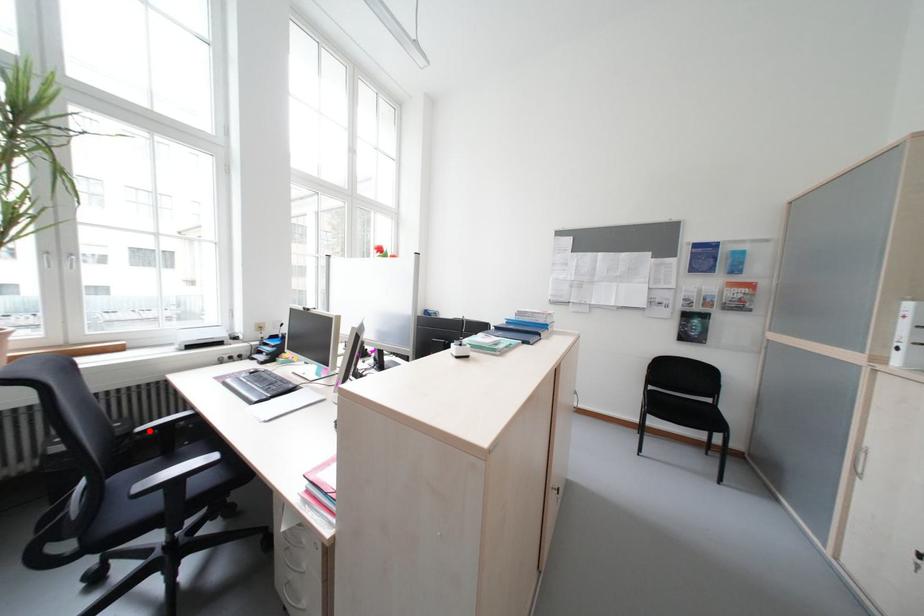
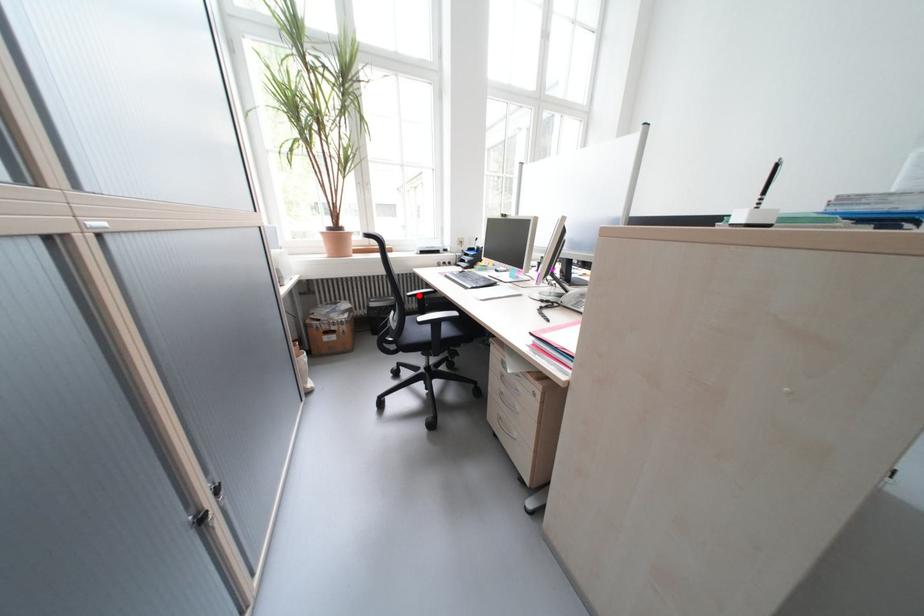
I am providing you with two images of the same scene from different viewpoints. A red point is marked on the first image and another point is marked on the second image. Do the highlighted points in image1 and image2 indicate the same real-world spot?

Yes